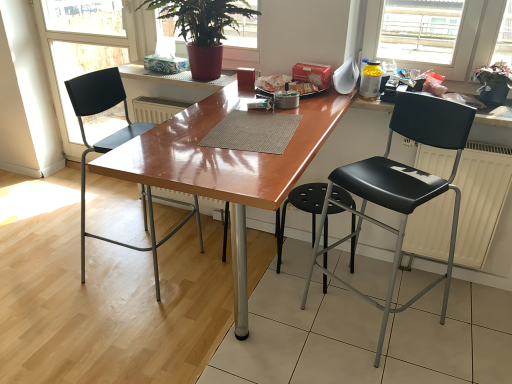
At what (x,y) coordinates should I click in order to perform the action: click on yellow translucent bottle at upper right. Please return your answer as a coordinate pair (x, y). Looking at the image, I should click on (370, 81).

The width and height of the screenshot is (512, 384). What are the coordinates of `black plastic stool at center` in the screenshot? It's located at (303, 208).

Locate an element on the screen. green leafy plant at upper right, which is the 2th houseplant in left-to-right order is located at coordinates (494, 82).

What do you see at coordinates (225, 166) in the screenshot? I see `glossy wood desk at center` at bounding box center [225, 166].

How much space does green leafy plant at upper center, acting as the first houseplant starting from the left, occupy vertically?

The height of green leafy plant at upper center, acting as the first houseplant starting from the left, is 41.04 centimeters.

Image resolution: width=512 pixels, height=384 pixels. What do you see at coordinates (202, 29) in the screenshot?
I see `green leafy plant at upper center, acting as the first houseplant starting from the left` at bounding box center [202, 29].

Find the location of `yellow translucent bottle at upper right`. yellow translucent bottle at upper right is located at coordinates (370, 81).

Could you tell me if black leather chair at right, the second chair from the left, is facing white matte radiator at right?

Yes, black leather chair at right, the second chair from the left, is facing white matte radiator at right.

Considering the sizes of objects black leather chair at right, the second chair from the left, and white matte radiator at right in the image provided, who is thinner, black leather chair at right, the second chair from the left, or white matte radiator at right?

Thinner between the two is white matte radiator at right.

Who is taller, black leather chair at right, marked as the first chair in a right-to-left arrangement, or white matte radiator at right?

black leather chair at right, marked as the first chair in a right-to-left arrangement.

Is black leather chair at right, the second chair from the left, next to white matte radiator at right and touching it?

black leather chair at right, the second chair from the left, is not next to white matte radiator at right, and they're not touching.

Considering the points (419, 218) and (338, 191), which point is in front, point (419, 218) or point (338, 191)?

The point (419, 218) is in front.

Between white matte radiator at right and black plastic stool at center, which one has more height?

Standing taller between the two is white matte radiator at right.

Is black plastic stool at center inside white matte radiator at right?

That's incorrect, black plastic stool at center is not inside white matte radiator at right.

Could you measure the distance between red cardboard box at upper center and green leafy plant at upper right, which ranks as the first houseplant in right-to-left order?

28.34 inches.

Is red cardboard box at upper center facing towards green leafy plant at upper right, which ranks as the first houseplant in right-to-left order?

No.

Between red cardboard box at upper center and green leafy plant at upper right, which ranks as the first houseplant in right-to-left order, which one has smaller width?

red cardboard box at upper center.

Considering the sizes of objects red cardboard box at upper center and green leafy plant at upper right, which ranks as the first houseplant in right-to-left order, in the image provided, who is bigger, red cardboard box at upper center or green leafy plant at upper right, which ranks as the first houseplant in right-to-left order,?

green leafy plant at upper right, which ranks as the first houseplant in right-to-left order, is bigger.

Considering the sizes of objects green leafy plant at upper right, which ranks as the first houseplant in right-to-left order, and green leafy plant at upper center, acting as the first houseplant starting from the left, in the image provided, who is smaller, green leafy plant at upper right, which ranks as the first houseplant in right-to-left order, or green leafy plant at upper center, acting as the first houseplant starting from the left,?

green leafy plant at upper right, which ranks as the first houseplant in right-to-left order.

Is green leafy plant at upper right, which is the 2th houseplant in left-to-right order, turned away from green leafy plant at upper center, arranged as the second houseplant when viewed from the right?

No.

Does point (487, 75) come in front of point (216, 8)?

Yes, point (487, 75) is closer to viewer.

Is green leafy plant at upper right, which ranks as the first houseplant in right-to-left order, wider than green leafy plant at upper center, arranged as the second houseplant when viewed from the right?

No, green leafy plant at upper right, which ranks as the first houseplant in right-to-left order, is not wider than green leafy plant at upper center, arranged as the second houseplant when viewed from the right.

From a real-world perspective, is white matte radiator at right physically above black leather chair at right, marked as the first chair in a right-to-left arrangement?

No, from a real-world perspective, white matte radiator at right is not over black leather chair at right, marked as the first chair in a right-to-left arrangement

Which of these two, white matte radiator at right or black leather chair at right, marked as the first chair in a right-to-left arrangement, is bigger?

black leather chair at right, marked as the first chair in a right-to-left arrangement.

Is white matte radiator at right oriented away from black leather chair at right, marked as the first chair in a right-to-left arrangement?

No, white matte radiator at right is not facing away from black leather chair at right, marked as the first chair in a right-to-left arrangement.

How distant is black leather chair at right, the second chair from the left, from green leafy plant at upper right, which is the 2th houseplant in left-to-right order?

23.31 inches.

From the image's perspective, is black leather chair at right, marked as the first chair in a right-to-left arrangement, beneath green leafy plant at upper right, which ranks as the first houseplant in right-to-left order?

Yes.

Which chair is the 2nd one when counting from the front of the green leafy plant at upper right, which ranks as the first houseplant in right-to-left order? Please provide its 2D coordinates.

[(401, 186)]

From a real-world perspective, is black leather chair at right, the second chair from the left, located higher than green leafy plant at upper right, which is the 2th houseplant in left-to-right order?

No.

Is black plastic chair at left, which is counted as the second chair, starting from the right, thinner than matte black chair at left?

→ No, black plastic chair at left, which is counted as the second chair, starting from the right, is not thinner than matte black chair at left.

From the image's perspective, between black plastic chair at left, which is counted as the second chair, starting from the right, and matte black chair at left, who is located below?

From the image's view, black plastic chair at left, which is counted as the second chair, starting from the right, is below.

Which of these two, black plastic chair at left, the 1th chair when ordered from left to right, or matte black chair at left, stands taller?

With more height is matte black chair at left.

Is matte black chair at left at the back of black plastic chair at left, which is counted as the second chair, starting from the right?

No.

I want to click on radiator on the right side of black leather chair at right, the second chair from the left, so click(480, 199).

Where is `stool below the white matte radiator at right (from the image's perspective)`? The height and width of the screenshot is (384, 512). stool below the white matte radiator at right (from the image's perspective) is located at coordinates (303, 208).

Looking at the image, which one is located further to red cardboard box at upper center, yellow translucent bottle at upper right or black plastic stool at center?

Based on the image, black plastic stool at center appears to be further to red cardboard box at upper center.

Considering their positions, is green leafy plant at upper right, which is the 2th houseplant in left-to-right order, positioned further to black plastic chair at left, which is counted as the second chair, starting from the right, than glossy wood desk at center?

green leafy plant at upper right, which is the 2th houseplant in left-to-right order.

From the image, which object appears to be nearer to red cardboard box at upper center, green leafy plant at upper right, which is the 2th houseplant in left-to-right order, or black leather chair at right, marked as the first chair in a right-to-left arrangement?

Among the two, black leather chair at right, marked as the first chair in a right-to-left arrangement, is located nearer to red cardboard box at upper center.

Looking at the image, which one is located further to black leather chair at right, marked as the first chair in a right-to-left arrangement, white matte radiator at right or black plastic stool at center?

black plastic stool at center is further to black leather chair at right, marked as the first chair in a right-to-left arrangement.

Looking at the image, which one is located further to red cardboard box at upper center, black leather chair at right, the second chair from the left, or black plastic chair at left, the 1th chair when ordered from left to right?

black plastic chair at left, the 1th chair when ordered from left to right, is further to red cardboard box at upper center.

Based on their spatial positions, is black plastic chair at left, which is counted as the second chair, starting from the right, or matte black chair at left further from white matte radiator at right?

Among the two, matte black chair at left is located further to white matte radiator at right.

Which object lies nearer to the anchor point black plastic chair at left, the 1th chair when ordered from left to right, green leafy plant at upper right, which ranks as the first houseplant in right-to-left order, or black leather chair at right, the second chair from the left?

black leather chair at right, the second chair from the left, is positioned closer to the anchor black plastic chair at left, the 1th chair when ordered from left to right.

From the image, which object appears to be nearer to white matte radiator at right, green leafy plant at upper right, which ranks as the first houseplant in right-to-left order, or red cardboard box at upper center?

green leafy plant at upper right, which ranks as the first houseplant in right-to-left order, lies closer to white matte radiator at right than the other object.

Find the location of `houseplant located between black plastic chair at left, which is counted as the second chair, starting from the right, and red cardboard box at upper center in the left-right direction`. houseplant located between black plastic chair at left, which is counted as the second chair, starting from the right, and red cardboard box at upper center in the left-right direction is located at coordinates (202, 29).

At what (x,y) coordinates should I click in order to perform the action: click on stool between black plastic chair at left, which is counted as the second chair, starting from the right, and yellow translucent bottle at upper right from left to right. Please return your answer as a coordinate pair (x, y). The image size is (512, 384). Looking at the image, I should click on (303, 208).

You are a GUI agent. You are given a task and a screenshot of the screen. Output one action in this format:
    pyautogui.click(x=<x>, y=<y>)
    Task: Click on the radiator between red cardboard box at upper center and black plastic stool at center in the vertical direction
    The height and width of the screenshot is (384, 512).
    Given the screenshot: What is the action you would take?
    [480, 199]

Identify the location of radiator between matte black chair at left and green leafy plant at upper right, which ranks as the first houseplant in right-to-left order, from left to right. (480, 199).